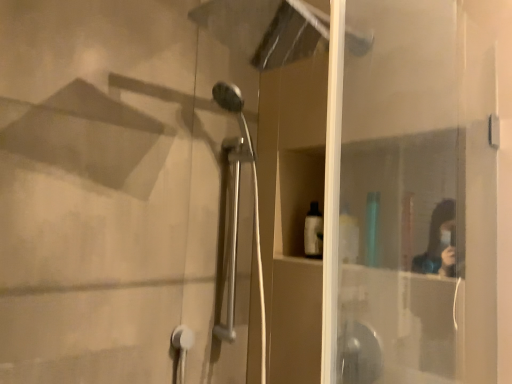
Image resolution: width=512 pixels, height=384 pixels. What do you see at coordinates (414, 196) in the screenshot? I see `transparent glass screen door at upper right` at bounding box center [414, 196].

Where is `transparent glass screen door at upper right`? This screenshot has width=512, height=384. transparent glass screen door at upper right is located at coordinates (414, 196).

Where is `transparent glass screen door at upper right`? transparent glass screen door at upper right is located at coordinates (414, 196).